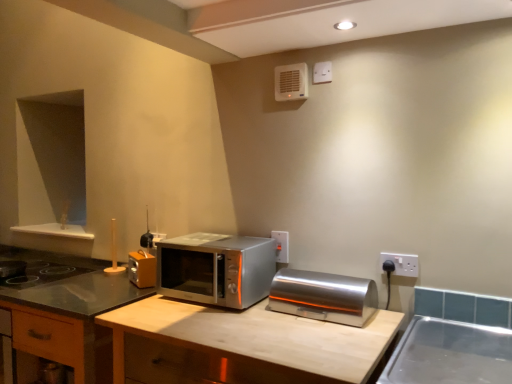
Question: From the image's perspective, does wooden cabinet at center appear lower than satin silver toaster at center?

Choices:
 (A) yes
 (B) no

Answer: (A)

Question: Is wooden cabinet at center smaller than satin silver toaster at center?

Choices:
 (A) yes
 (B) no

Answer: (B)

Question: From the image's perspective, is wooden cabinet at center above satin silver toaster at center?

Choices:
 (A) yes
 (B) no

Answer: (B)

Question: Is wooden cabinet at center positioned with its back to satin silver toaster at center?

Choices:
 (A) yes
 (B) no

Answer: (B)

Question: Is wooden cabinet at center completely or partially outside of satin silver toaster at center?

Choices:
 (A) yes
 (B) no

Answer: (A)

Question: Considering their positions, is white plastic air conditioner at upper center located in front of or behind white plastic electric outlet at center, the 2th electric outlet in the front-to-back sequence?

Choices:
 (A) front
 (B) behind

Answer: (A)

Question: Is white plastic air conditioner at upper center to the left or to the right of white plastic electric outlet at center, marked as the 1th electric outlet in a left-to-right arrangement, in the image?

Choices:
 (A) right
 (B) left

Answer: (A)

Question: Considering the positions of point (280, 99) and point (284, 254), is point (280, 99) closer or farther from the camera than point (284, 254)?

Choices:
 (A) farther
 (B) closer

Answer: (B)

Question: Is white plastic air conditioner at upper center bigger or smaller than white plastic electric outlet at center, acting as the 2th electric outlet starting from the right?

Choices:
 (A) small
 (B) big

Answer: (B)

Question: Is wooden at center taller or shorter than white plastic electric outlet at center, the 2th electric outlet in the front-to-back sequence?

Choices:
 (A) tall
 (B) short

Answer: (A)

Question: Considering the positions of point (346, 344) and point (287, 243), is point (346, 344) closer or farther from the camera than point (287, 243)?

Choices:
 (A) closer
 (B) farther

Answer: (A)

Question: Looking at their shapes, would you say wooden at center is wider or thinner than white plastic electric outlet at center, acting as the 2th electric outlet starting from the right?

Choices:
 (A) wide
 (B) thin

Answer: (A)

Question: Is wooden at center situated inside white plastic electric outlet at center, acting as the 2th electric outlet starting from the right, or outside?

Choices:
 (A) inside
 (B) outside

Answer: (B)

Question: Is satin silver microwave at center wider or thinner than wooden cabinet at center?

Choices:
 (A) thin
 (B) wide

Answer: (A)

Question: Is satin silver microwave at center taller or shorter than wooden cabinet at center?

Choices:
 (A) short
 (B) tall

Answer: (A)